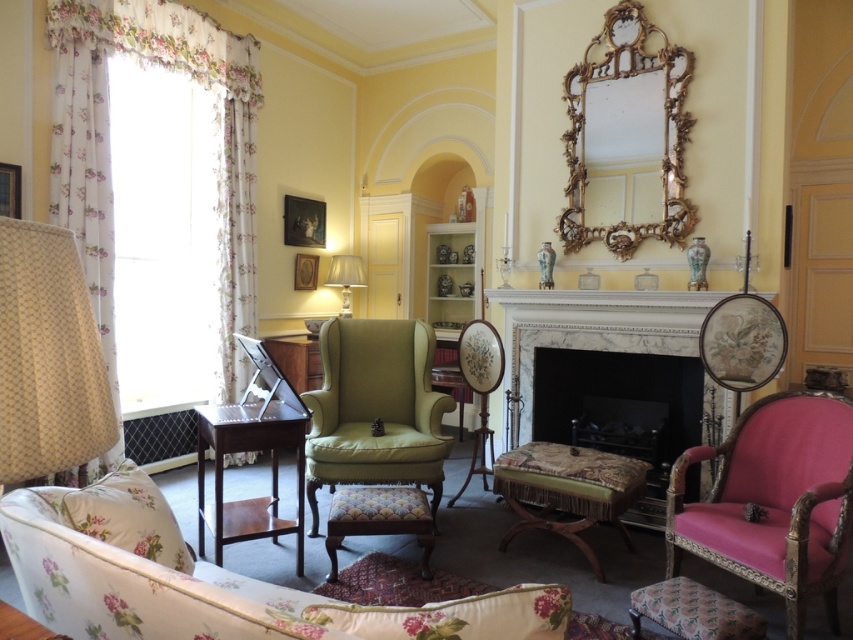
Question: Is floral fabric curtain at left smaller than patterned fabric ottoman at center?

Choices:
 (A) no
 (B) yes

Answer: (A)

Question: From the image, what is the correct spatial relationship of marble fireplace at center in relation to matte cream lampshade at center?

Choices:
 (A) left
 (B) right

Answer: (B)

Question: Which is farther from the matte yellow fabric lampshade at left?

Choices:
 (A) marble fireplace at center
 (B) wooden picture frame at left
 (C) floral fabric couch at lower left

Answer: (A)

Question: From the image, what is the correct spatial relationship of wooden picture frame at upper left in relation to matte cream lampshade at center?

Choices:
 (A) right
 (B) left

Answer: (B)

Question: Which object is closer to the camera taking this photo?

Choices:
 (A) wooden picture frame at left
 (B) gold ornate mirror at upper center
 (C) patterned fabric ottoman at center
 (D) floral fabric couch at lower left

Answer: (D)

Question: Estimate the real-world distances between objects in this image. Which object is closer to the wooden picture frame at left?

Choices:
 (A) matte yellow fabric lampshade at left
 (B) pink velvet armchair at right
 (C) marble fireplace at center

Answer: (A)